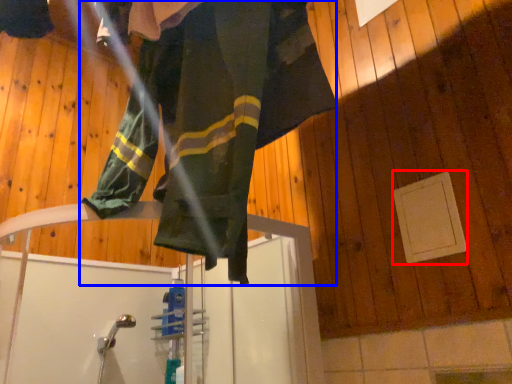
Question: Among these objects, which one is farthest to the camera, panel (highlighted by a red box) or woman (highlighted by a blue box)?

Choices:
 (A) panel
 (B) woman

Answer: (A)